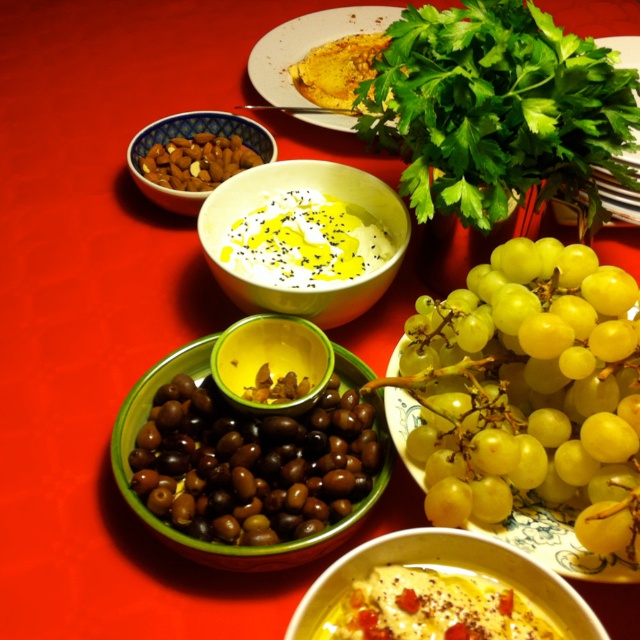
Question: Among these points, which one is nearest to the camera?

Choices:
 (A) (243, 163)
 (B) (496, 208)

Answer: (B)

Question: Is yellow creamy soup at center smaller than matte yellow bowl at center?

Choices:
 (A) yes
 (B) no

Answer: (B)

Question: Can you confirm if green leafy parsley at center is smaller than matte yellow bowl at center?

Choices:
 (A) no
 (B) yes

Answer: (A)

Question: Which object is farther from the camera taking this photo?

Choices:
 (A) green matte grapes at center-right
 (B) yellow matte bread at center

Answer: (B)

Question: Which object appears closest to the camera in this image?

Choices:
 (A) matte yellow bowl at center
 (B) green matte olives at center
 (C) green matte grapes at center-right

Answer: (C)

Question: Is matte ceramic bowl at lower center positioned at the back of matte yellow bowl at center?

Choices:
 (A) no
 (B) yes

Answer: (A)